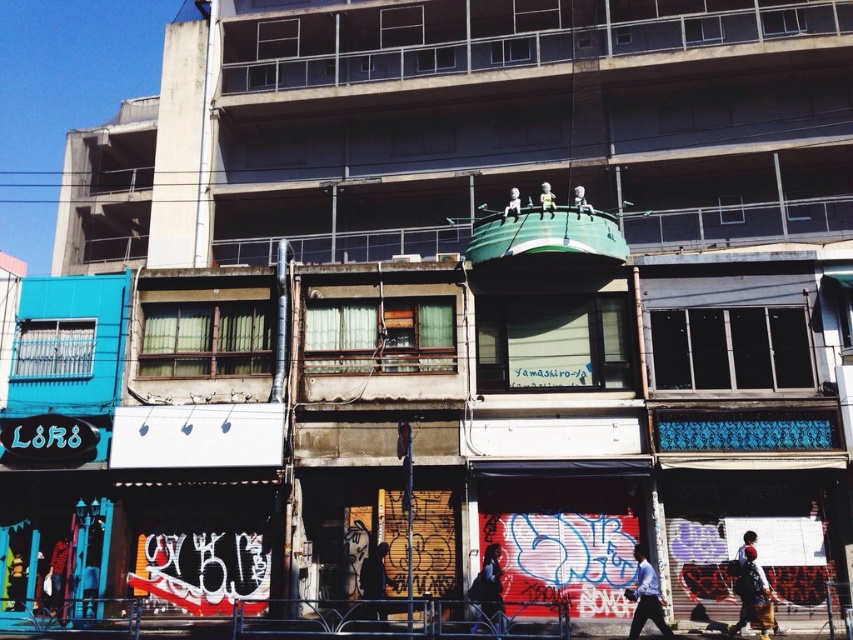
The height and width of the screenshot is (640, 853). Identify the location of metallic statue at upper center. pyautogui.click(x=546, y=198).

The height and width of the screenshot is (640, 853). Describe the element at coordinates (546, 198) in the screenshot. I see `metallic statue at upper center` at that location.

Identify the location of metallic statue at upper center. (546, 198).

Is dark clothing figure at lower center positioned in front of metallic statue at upper center?

Yes, dark clothing figure at lower center is in front of metallic statue at upper center.

Describe the element at coordinates (374, 586) in the screenshot. I see `dark clothing figure at lower center` at that location.

Where is `dark clothing figure at lower center`? The image size is (853, 640). dark clothing figure at lower center is located at coordinates (374, 586).

Is dark clothing figure at lower center taller than metallic astronaut at upper center?

Incorrect, dark clothing figure at lower center's height is not larger of metallic astronaut at upper center's.

Consider the image. Is dark clothing figure at lower center to the right of metallic astronaut at upper center from the viewer's perspective?

Incorrect, dark clothing figure at lower center is not on the right side of metallic astronaut at upper center.

Locate an element on the screen. dark clothing figure at lower center is located at coordinates [374, 586].